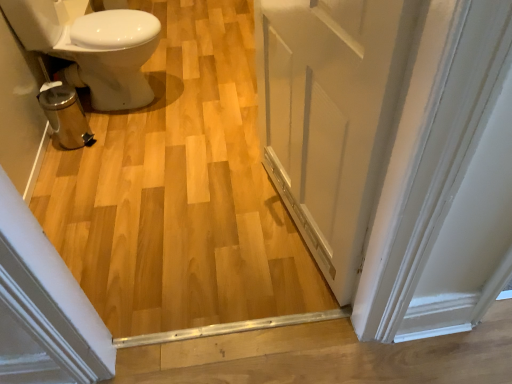
Locate an element on the screen. vacant space to the right of white glossy bidet at left is located at coordinates (212, 92).